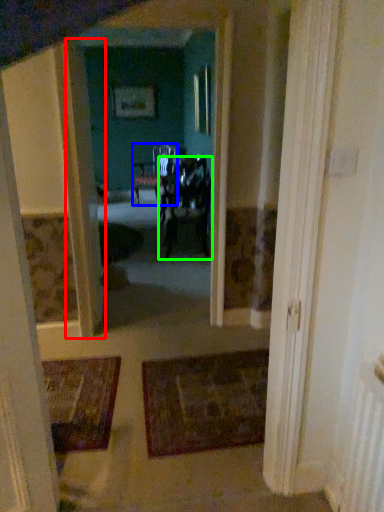
Question: Based on their relative distances, which object is nearer to door (highlighted by a red box)? Choose from chair (highlighted by a blue box) and chair (highlighted by a green box).

Choices:
 (A) chair
 (B) chair

Answer: (B)